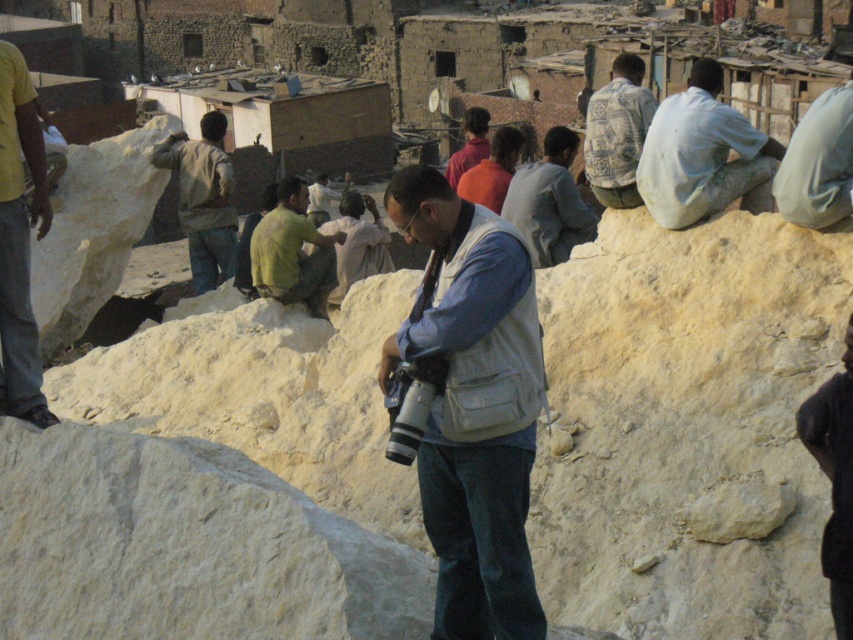
Who is taller, light gray fabric pants at upper right or patterned fabric shirt at upper right?

Standing taller between the two is patterned fabric shirt at upper right.

How distant is light gray fabric pants at upper right from patterned fabric shirt at upper right?

The distance of light gray fabric pants at upper right from patterned fabric shirt at upper right is 5.65 meters.

The width and height of the screenshot is (853, 640). What do you see at coordinates (817, 163) in the screenshot?
I see `light gray fabric pants at upper right` at bounding box center [817, 163].

Find the location of `light gray fabric pants at upper right`. light gray fabric pants at upper right is located at coordinates (817, 163).

Does point (207, 285) lie in front of point (851, 177)?

No, it is behind (851, 177).

Image resolution: width=853 pixels, height=640 pixels. Describe the element at coordinates (202, 198) in the screenshot. I see `light brown fabric jacket at left` at that location.

Where is `light brown fabric jacket at left`? The height and width of the screenshot is (640, 853). light brown fabric jacket at left is located at coordinates pos(202,198).

Between matte beige vest at center and light gray fabric shirt at upper center, which one has more height?

Standing taller between the two is light gray fabric shirt at upper center.

Can you confirm if matte beige vest at center is taller than light gray fabric shirt at upper center?

No, matte beige vest at center is not taller than light gray fabric shirt at upper center.

Between point (492, 241) and point (554, 164), which one is positioned behind?

Positioned behind is point (554, 164).

I want to click on matte beige vest at center, so 473,404.